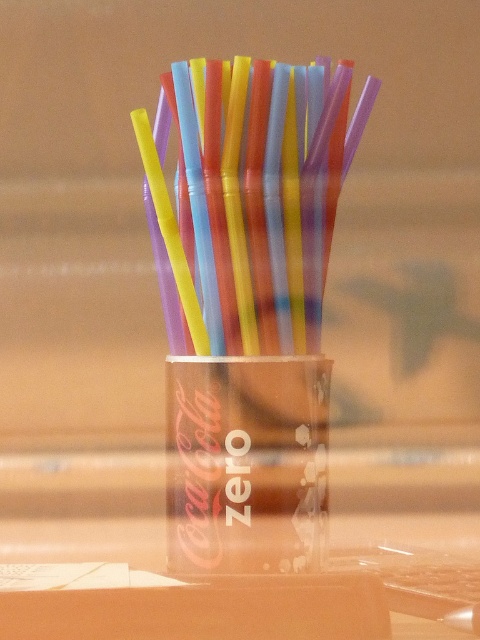
From the picture: You are a quality inspector checking the Coca Cola Zero cup. You need to verify if the point at coordinates [255,198] is within the area of the translucent plastic straws at center. Is it?

The point at coordinates [255,198] corresponds to the translucent plastic straws at center, so yes, it is within that area.

You are at a party and want to grab the transparent plastic cup at center without disturbing the translucent plastic straws at center. Can you do it easily?

The translucent plastic straws at center are only 4.38 inches away from the transparent plastic cup at center, so you can carefully grab the transparent plastic cup at center without disturbing the straws.

You are at a party and need to determine if the translucent plastic straws at center can fit entirely inside the transparent plastic cup at center. Can they be fully submerged when placed inside?

The translucent plastic straws at center are taller than the transparent plastic cup at center, so they cannot be fully submerged when placed inside.